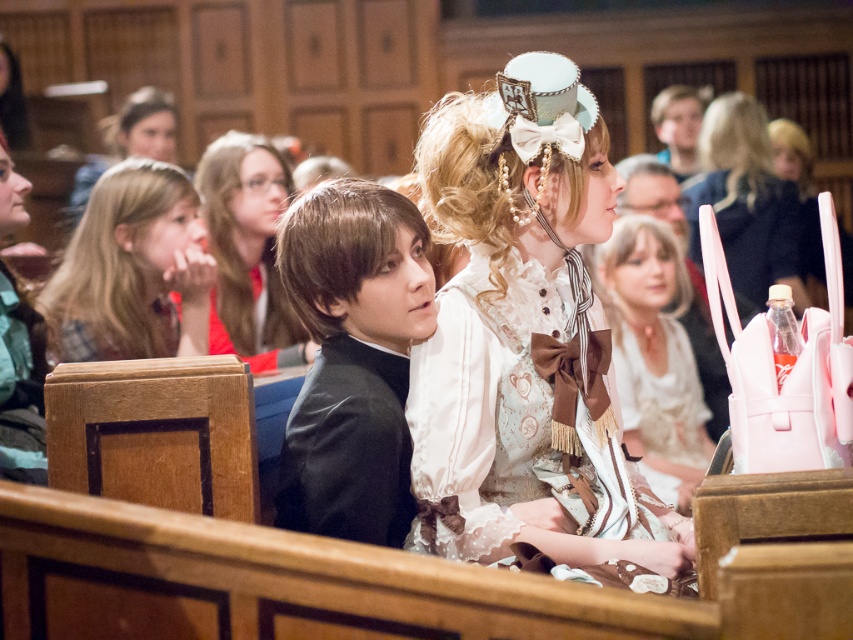
Which is below, white lace dress at center or matte white dress at center?

white lace dress at center

Between point (514, 428) and point (698, 454), which one is positioned behind?

Positioned behind is point (698, 454).

Which is in front, point (515, 400) or point (683, 460)?

Point (515, 400) is in front.

Locate an element on the screen. white lace dress at center is located at coordinates (517, 435).

Which is more to the right, blonde hair at center or matte black dress at center?

From the viewer's perspective, matte black dress at center appears more on the right side.

Which of these two, blonde hair at center or matte black dress at center, stands shorter?

Standing shorter between the two is blonde hair at center.

Is point (154, 275) positioned in front of point (283, 328)?

Yes, it is.

This screenshot has width=853, height=640. What are the coordinates of `blonde hair at center` in the screenshot? It's located at (131, 269).

Which is below, black satin suit at center or blonde hair at center?

black satin suit at center

Identify the location of black satin suit at center. The width and height of the screenshot is (853, 640). [x=352, y=358].